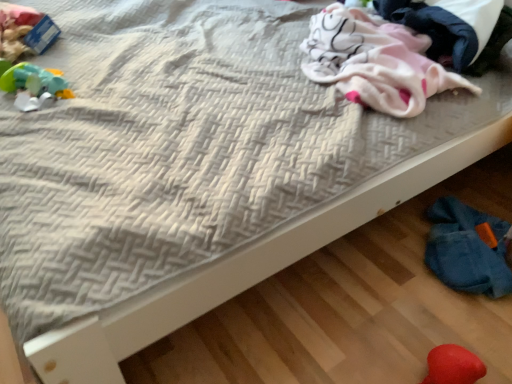
Question: From the image's perspective, does pink soft fabric at upper right appear lower than rubberized green toy at left, the 2th toy when ordered from bottom to top?

Choices:
 (A) yes
 (B) no

Answer: (B)

Question: Is pink soft fabric at upper right wider than rubberized green toy at left, the 2th toy when ordered from bottom to top?

Choices:
 (A) no
 (B) yes

Answer: (B)

Question: Does pink soft fabric at upper right lie in front of rubberized green toy at left, which is the first toy from back to front?

Choices:
 (A) yes
 (B) no

Answer: (A)

Question: Is pink soft fabric at upper right facing towards rubberized green toy at left, which is the first toy from back to front?

Choices:
 (A) yes
 (B) no

Answer: (A)

Question: Considering the relative sizes of pink soft fabric at upper right and rubberized green toy at left, the 2th toy from the right, in the image provided, is pink soft fabric at upper right bigger than rubberized green toy at left, the 2th toy from the right,?

Choices:
 (A) yes
 (B) no

Answer: (A)

Question: Is pink soft fabric at upper right at the right side of rubberized green toy at left, which is the first toy from back to front?

Choices:
 (A) no
 (B) yes

Answer: (B)

Question: Can you confirm if pink soft fabric at upper right is taller than pink fleece blanket at upper right?

Choices:
 (A) yes
 (B) no

Answer: (A)

Question: Would you say pink soft fabric at upper right contains pink fleece blanket at upper right?

Choices:
 (A) no
 (B) yes

Answer: (A)

Question: Is pink soft fabric at upper right far away from pink fleece blanket at upper right?

Choices:
 (A) no
 (B) yes

Answer: (A)

Question: Is pink soft fabric at upper right positioned beyond the bounds of pink fleece blanket at upper right?

Choices:
 (A) yes
 (B) no

Answer: (B)

Question: From the image's perspective, is pink soft fabric at upper right below pink fleece blanket at upper right?

Choices:
 (A) yes
 (B) no

Answer: (B)

Question: Is pink soft fabric at upper right with pink fleece blanket at upper right?

Choices:
 (A) yes
 (B) no

Answer: (B)

Question: From the image's perspective, is fuzzy red heart at lower right, the 1th toy positioned from the bottom, under pink fleece blanket at upper right?

Choices:
 (A) yes
 (B) no

Answer: (A)